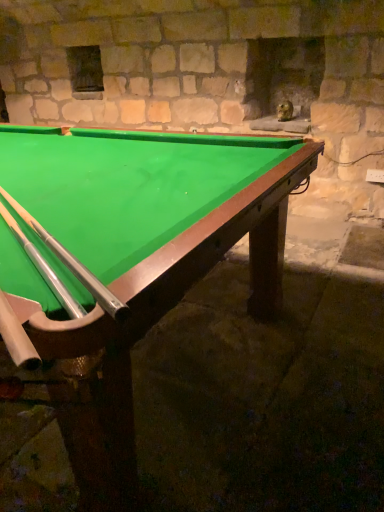
Question: In the image, is green felt billiard table at center positioned in front of or behind silver/smooth cue at lower left?

Choices:
 (A) behind
 (B) front

Answer: (B)

Question: From their relative heights in the image, would you say green felt billiard table at center is taller or shorter than silver/smooth cue at lower left?

Choices:
 (A) tall
 (B) short

Answer: (A)

Question: Considering the positions of point (145, 312) and point (120, 311), is point (145, 312) closer or farther from the camera than point (120, 311)?

Choices:
 (A) closer
 (B) farther

Answer: (B)

Question: In the image, is silver/smooth cue at lower left positioned in front of or behind green felt billiard table at center?

Choices:
 (A) front
 (B) behind

Answer: (B)

Question: Considering the positions of silver/smooth cue at lower left and green felt billiard table at center in the image, is silver/smooth cue at lower left bigger or smaller than green felt billiard table at center?

Choices:
 (A) big
 (B) small

Answer: (B)

Question: From the image's perspective, relative to green felt billiard table at center, is silver/smooth cue at lower left above or below?

Choices:
 (A) below
 (B) above

Answer: (B)

Question: Is silver/smooth cue at lower left to the left or to the right of green felt billiard table at center in the image?

Choices:
 (A) left
 (B) right

Answer: (B)